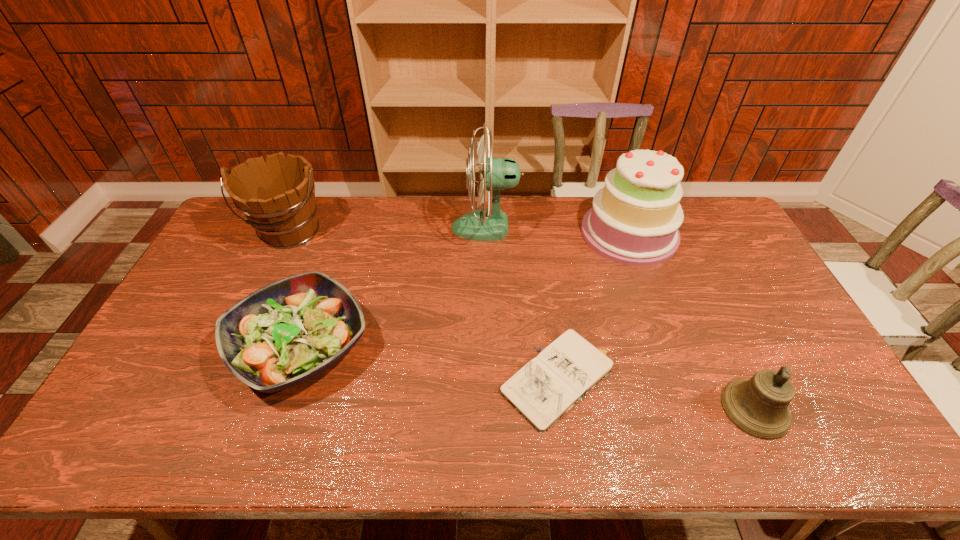
Identify the location of free spot located with the handle on the wine bucket. (270, 274).

Where is `vacant space located on the back of the third shortest object`? The width and height of the screenshot is (960, 540). vacant space located on the back of the third shortest object is located at coordinates coord(692,274).

The height and width of the screenshot is (540, 960). I want to click on free location located 0.280m on the back of the salad plate, so click(340, 235).

Where is `vacant space located on the right of the shortest object`? The height and width of the screenshot is (540, 960). vacant space located on the right of the shortest object is located at coordinates (673, 380).

Locate an element on the screen. The image size is (960, 540). fan present at the far edge is located at coordinates (495, 174).

At what (x,y) coordinates should I click in order to perform the action: click on cake that is positioned at the far edge. Please return your answer as a coordinate pair (x, y). Looking at the image, I should click on [x=634, y=220].

Locate an element on the screen. The width and height of the screenshot is (960, 540). wine bucket that is at the far edge is located at coordinates (277, 196).

This screenshot has width=960, height=540. Find the location of `bell that is positioned at the near edge`. bell that is positioned at the near edge is located at coordinates (758, 406).

Find the location of `notebook that is at the near edge`. notebook that is at the near edge is located at coordinates (548, 386).

The width and height of the screenshot is (960, 540). I want to click on object present at the left edge, so tap(277, 196).